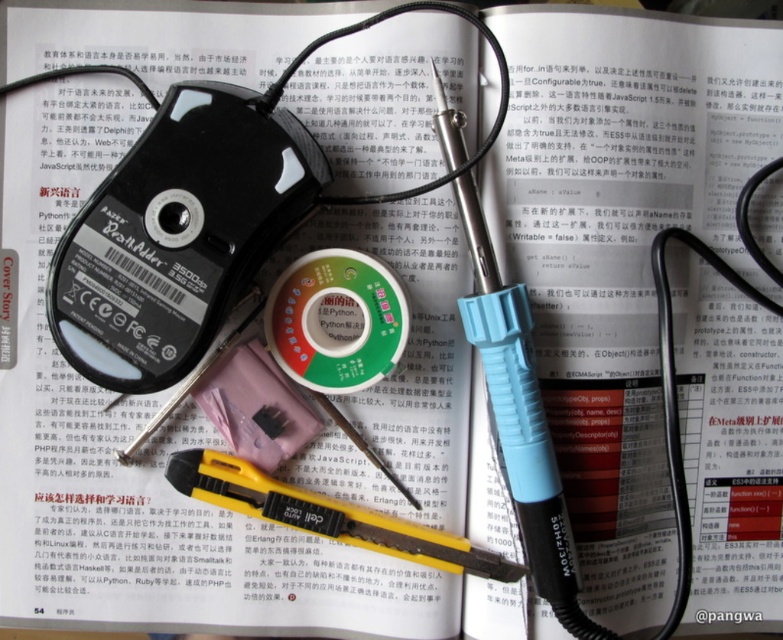
Question: Which object is closer to the camera taking this photo?

Choices:
 (A) black plastic soldering iron at center
 (B) black plastic ipod at center

Answer: (B)

Question: Which object is closer to the camera taking this photo?

Choices:
 (A) black plastic soldering iron at center
 (B) black plastic ipod at center

Answer: (B)

Question: Where is black plastic ipod at center located in relation to black plastic soldering iron at center in the image?

Choices:
 (A) above
 (B) below

Answer: (A)

Question: From the image, what is the correct spatial relationship of black plastic ipod at center in relation to black plastic soldering iron at center?

Choices:
 (A) right
 (B) left

Answer: (B)

Question: Considering the relative positions of black plastic ipod at center and black plastic soldering iron at center in the image provided, where is black plastic ipod at center located with respect to black plastic soldering iron at center?

Choices:
 (A) below
 (B) above

Answer: (B)